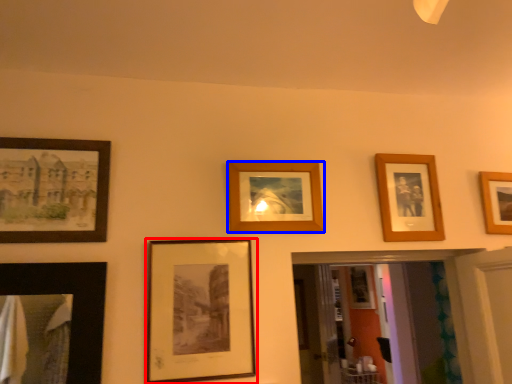
Question: Which object appears farthest to the camera in this image, picture frame (highlighted by a red box) or picture frame (highlighted by a blue box)?

Choices:
 (A) picture frame
 (B) picture frame

Answer: (B)